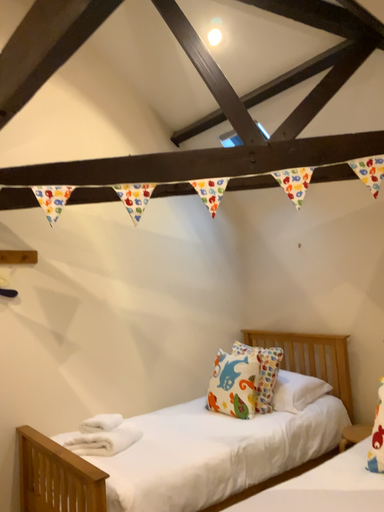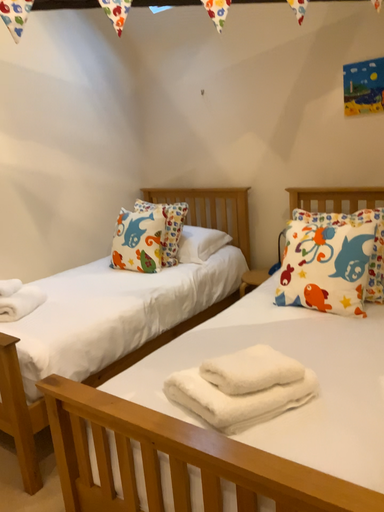
Question: How did the camera likely rotate when shooting the video?

Choices:
 (A) rotated upward
 (B) rotated downward

Answer: (B)